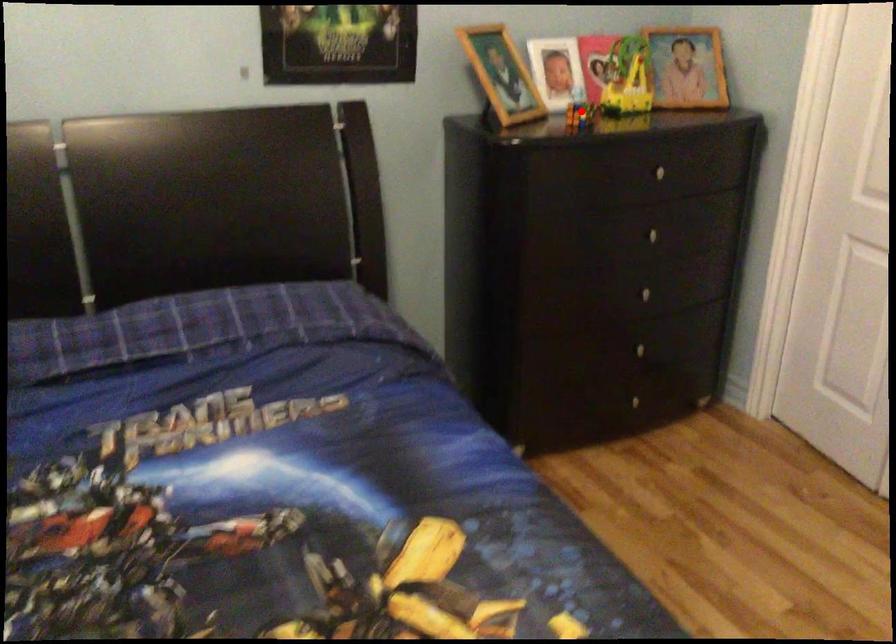
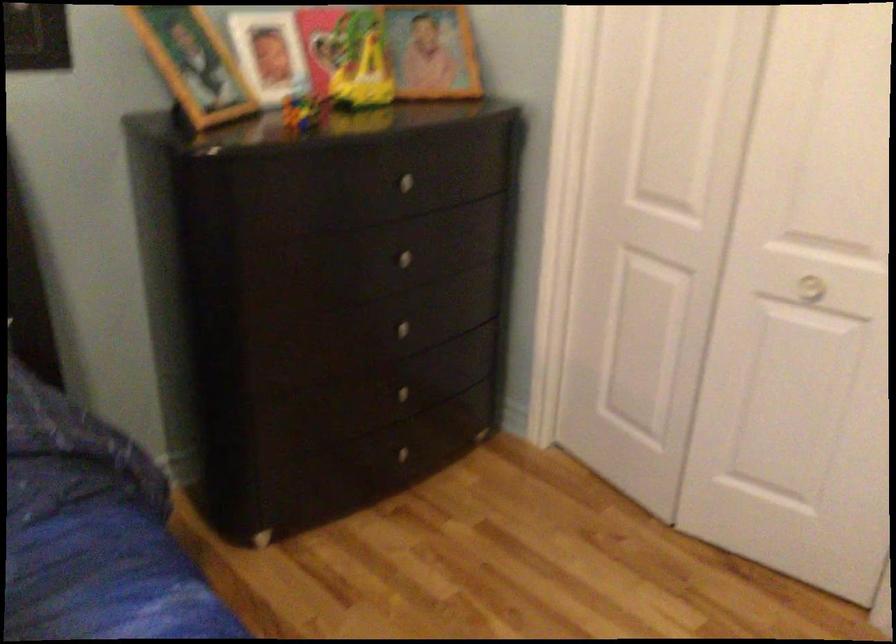
Question: I am providing you with two images of the same scene from different viewpoints. In image1, a red point is highlighted. Considering the same 3D point in image2, which of the following is correct?

Choices:
 (A) It is closer
 (B) It is farther

Answer: (A)